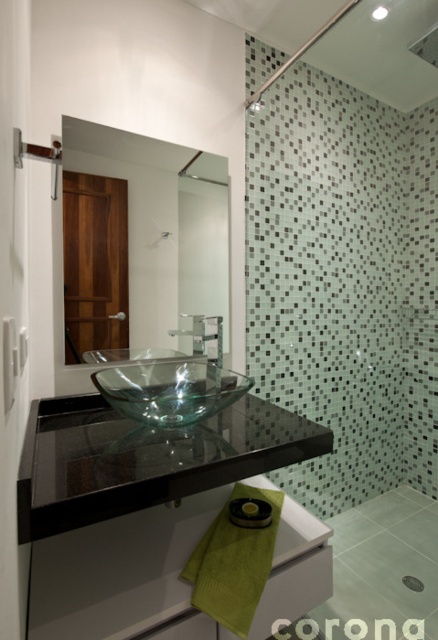
You are designing a layout for a bathroom and need to ensure that the clear glass mirror at upper center and the black rubber towel bar at lower center are spaced appropriately. Based on their positions and sizes, can you determine which object is wider?

The clear glass mirror at upper center is wider than the black rubber towel bar at lower center according to the description.

You are standing in the bathroom and want to check your reflection in the clear glass mirror at upper center. Where should you look to see your reflection?

You should look at the clear glass mirror at upper center, which is located at the coordinates 0.353 on the x axis and 0.372 on the y axis.